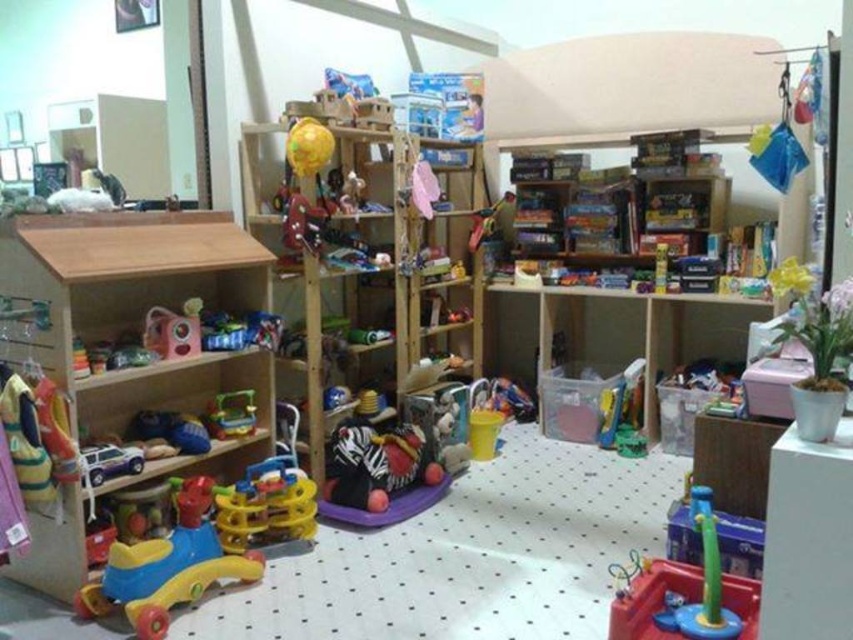
Question: Is matte plastic toy at center wider than metallic silver toy car at lower left?

Choices:
 (A) yes
 (B) no

Answer: (A)

Question: Among these objects, which one is nearest to the camera?

Choices:
 (A) rubber yellow and blue walker at lower left
 (B) translucent plastic toy at lower right
 (C) rubberized plastic walker at lower left
 (D) wooden toy at left

Answer: (B)

Question: Which point is closer to the camera?

Choices:
 (A) (172, 596)
 (B) (146, 333)
 (C) (166, 264)

Answer: (A)

Question: Which object is positioned farthest from the rubber yellow and blue walker at lower left?

Choices:
 (A) metallic silver toy car at lower left
 (B) translucent plastic toy at center

Answer: (B)

Question: From the image, what is the correct spatial relationship of translucent plastic toy at center in relation to metallic silver toy car at lower left?

Choices:
 (A) right
 (B) left

Answer: (A)

Question: In this image, where is rubberized plastic walker at lower left located relative to rubber yellow and blue walker at lower left?

Choices:
 (A) below
 (B) above

Answer: (A)